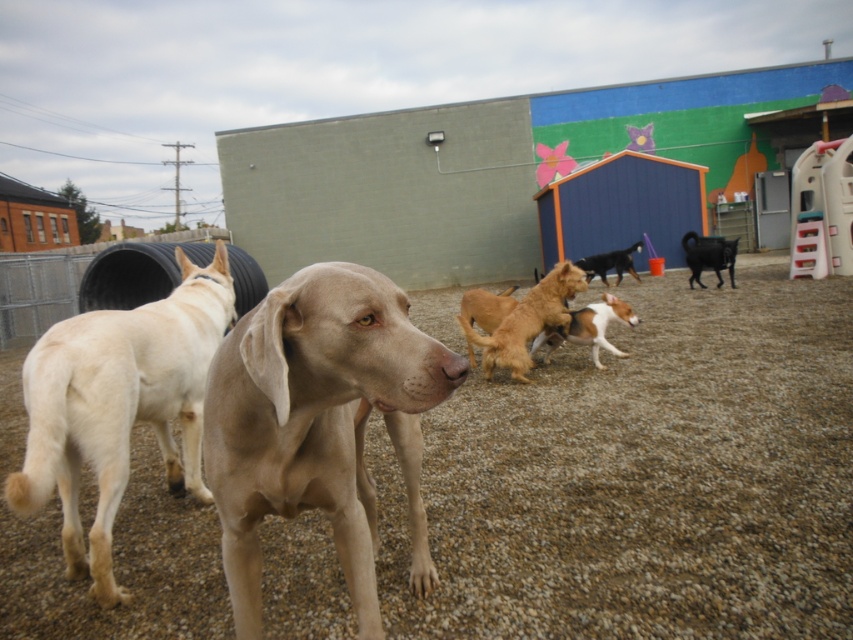
You are a photographer trying to capture a photo of both the white fur dog at center and the black glossy goat at center right. Based on their positions, which one should you focus on first to ensure both are in the frame?

The white fur dog at center is below the black glossy goat at center right, so you should focus on the black glossy goat at center right first to ensure both are in the frame.

Looking at this image, you are a dog owner who wants to ensure your pet has enough space to play safely. Based on the scene, which animal is shorter between the white fur dog at center and the black glossy goat at center right?

The white fur dog at center is shorter than the black glossy goat at center right.

You are standing at the point marked by the coordinates point (589, 328) in the dog park. Looking around, you see a light tan dog with long ears in the foreground and a white dog with a tan patch on its back walking away from you. Which dog is closer to your current position?

The white fur dog at center is at the coordinates point (589, 328), so you are standing right where the white fur dog is. The light tan dog with long ears in the foreground is closer to your current position because it is described as being in the foreground, which typically means it is nearer to the viewer.